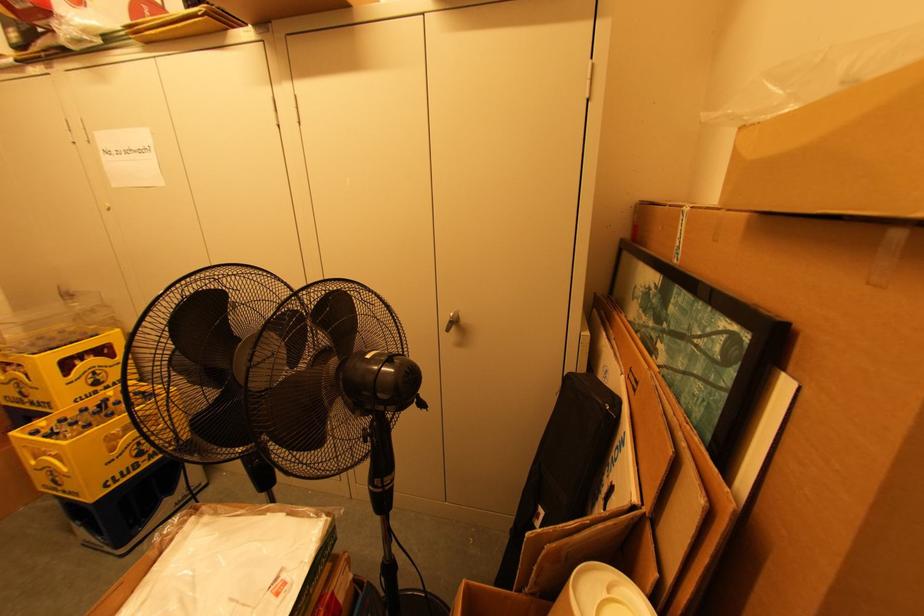
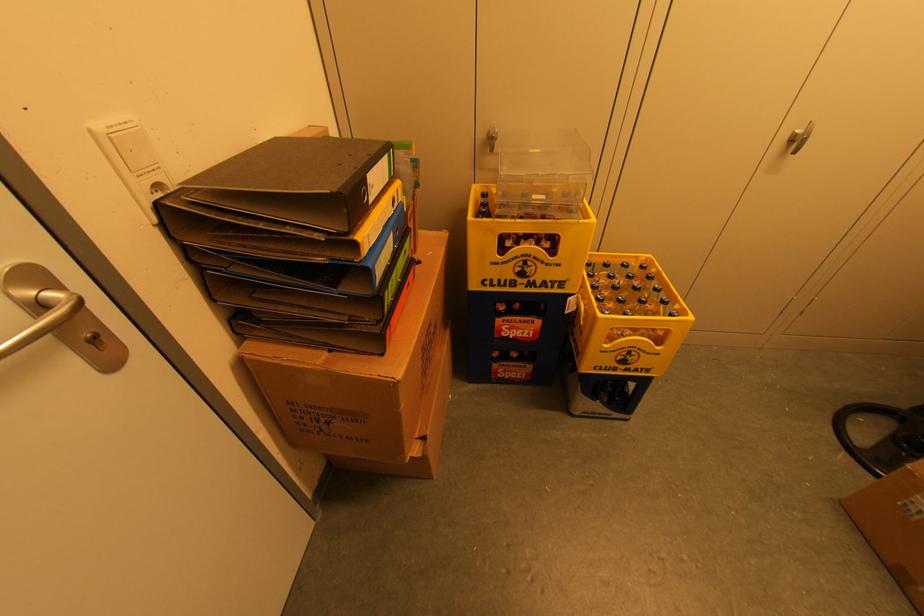
Locate, in the second image, the point that corresponds to pixel 73 493 in the first image.

(638, 370)